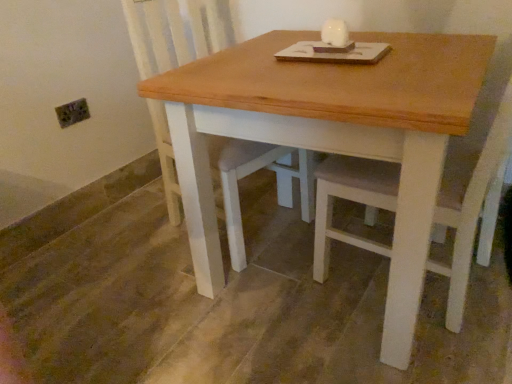
Question: Is wooden table at center wider or thinner than wooden swivel chair at center?

Choices:
 (A) wide
 (B) thin

Answer: (A)

Question: From the image's perspective, is wooden table at center above or below wooden swivel chair at center?

Choices:
 (A) below
 (B) above

Answer: (A)

Question: Considering the relative positions of wooden table at center and wooden swivel chair at center in the image provided, is wooden table at center to the left or to the right of wooden swivel chair at center?

Choices:
 (A) left
 (B) right

Answer: (B)

Question: Considering the positions of wooden swivel chair at center and wooden table at center in the image, is wooden swivel chair at center wider or thinner than wooden table at center?

Choices:
 (A) wide
 (B) thin

Answer: (B)

Question: Considering their positions, is wooden swivel chair at center located in front of or behind wooden table at center?

Choices:
 (A) behind
 (B) front

Answer: (A)

Question: Is wooden swivel chair at center inside or outside of wooden table at center?

Choices:
 (A) outside
 (B) inside

Answer: (B)

Question: In terms of height, does wooden swivel chair at center look taller or shorter compared to wooden table at center?

Choices:
 (A) tall
 (B) short

Answer: (A)